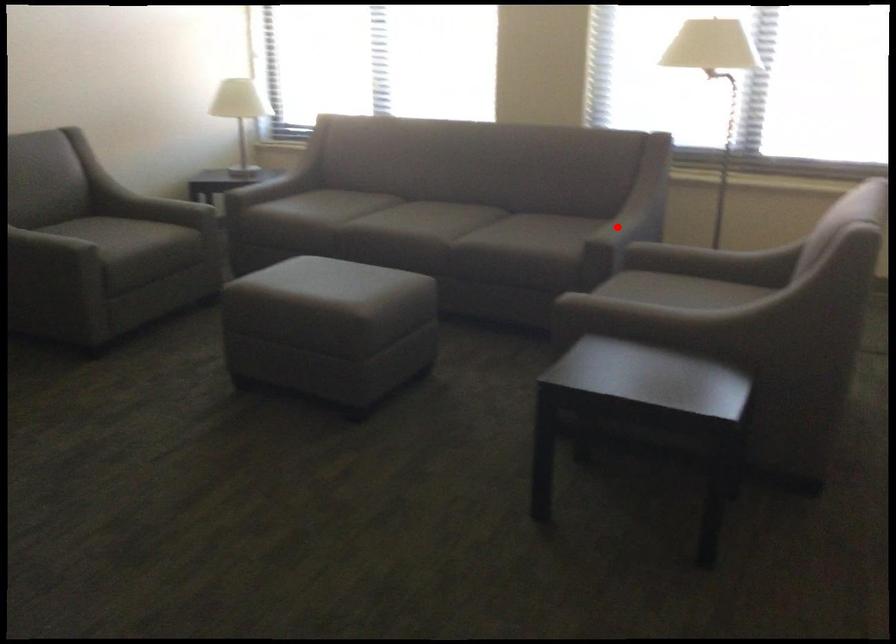
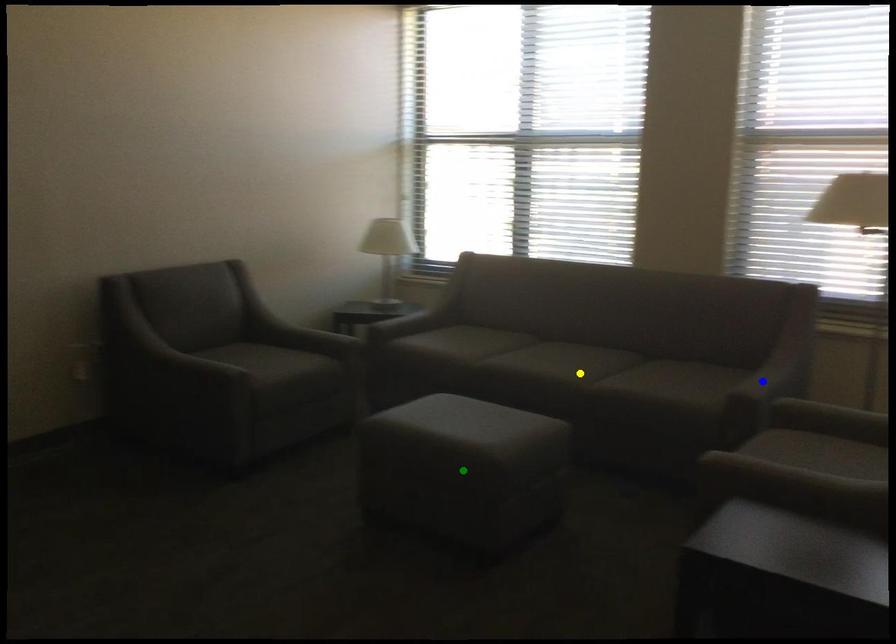
Question: I am providing you with two images of the same scene from different viewpoints. A red point is marked on the first image. You are given multiple points on the second image. Which mark in image 2 goes with the point in image 1?

Choices:
 (A) blue point
 (B) green point
 (C) yellow point

Answer: (A)